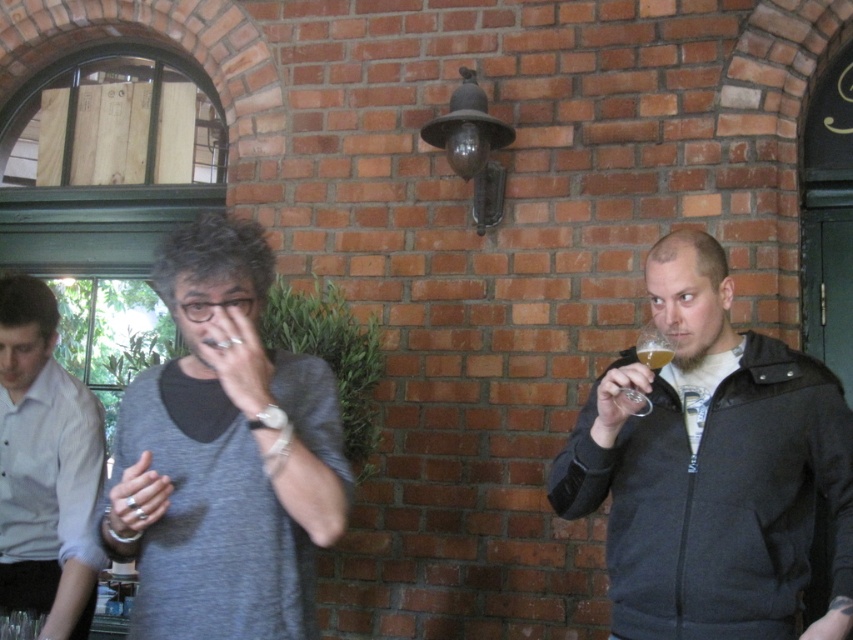
Question: Which of the following is the farthest from the observer?

Choices:
 (A) (635, 352)
 (B) (643, 406)

Answer: (A)

Question: Is dark gray zip-up jacket at right further to the viewer compared to clear glass wine glass at right?

Choices:
 (A) no
 (B) yes

Answer: (A)

Question: Is gray matte shirt at center positioned in front of light blue shirt at left?

Choices:
 (A) no
 (B) yes

Answer: (B)

Question: Can you confirm if gray matte shirt at center is smaller than light blue shirt at left?

Choices:
 (A) yes
 (B) no

Answer: (A)

Question: Which of these objects is positioned farthest from the gray matte shirt at center?

Choices:
 (A) translucent glass at right
 (B) light blue shirt at left

Answer: (A)

Question: Which of the following is the closest to the observer?

Choices:
 (A) (51, 438)
 (B) (654, 355)

Answer: (B)